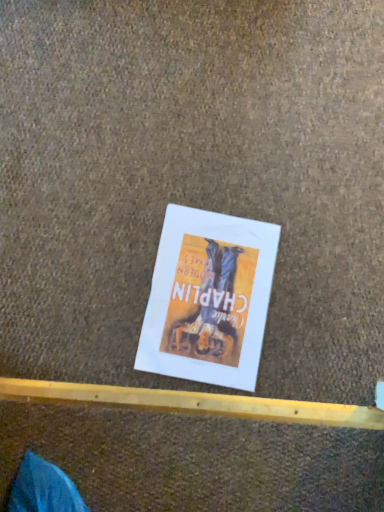
Where is `free point above white paper poster at center (from a real-world perspective)`? free point above white paper poster at center (from a real-world perspective) is located at coordinates (213, 300).